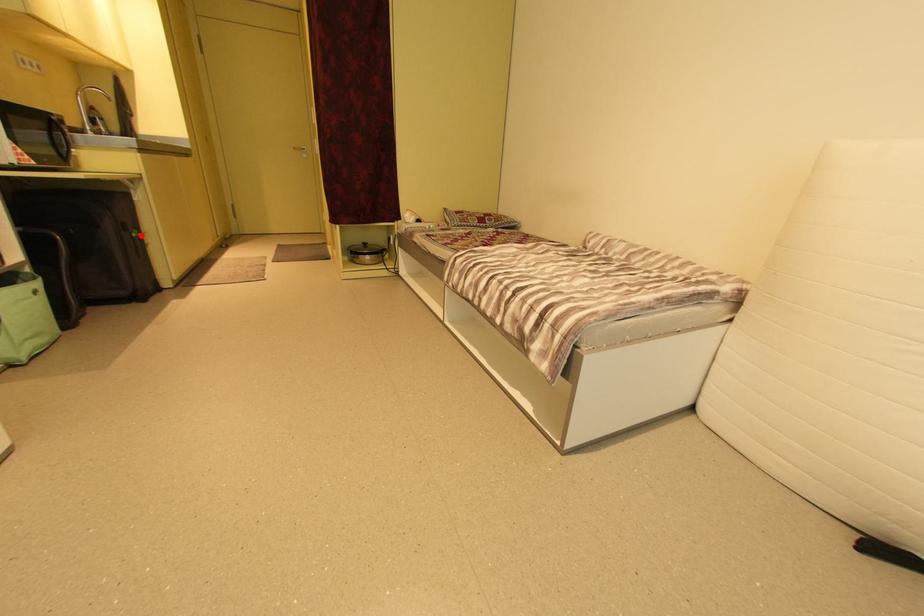
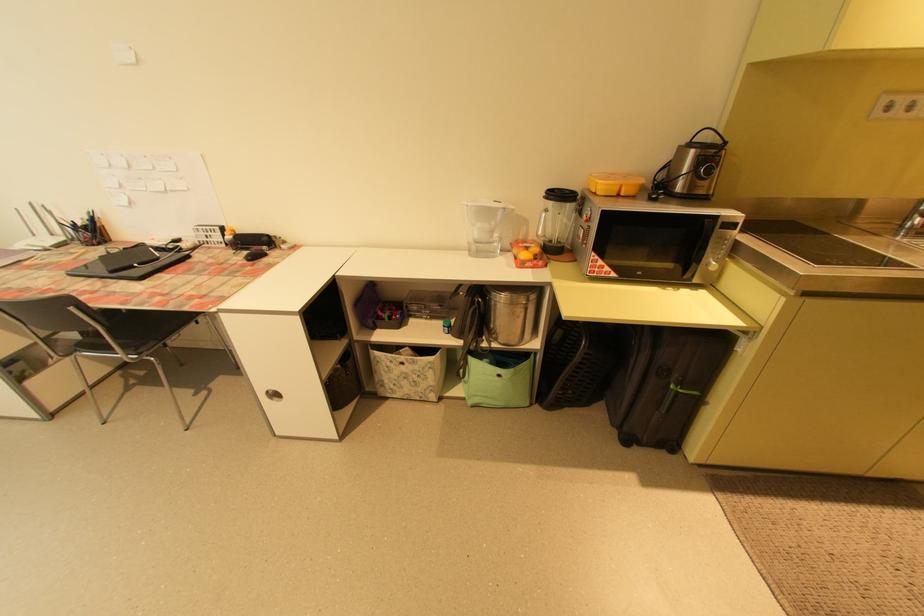
Locate, in the second image, the point that corresponds to the highlighted location in the first image.

(678, 387)